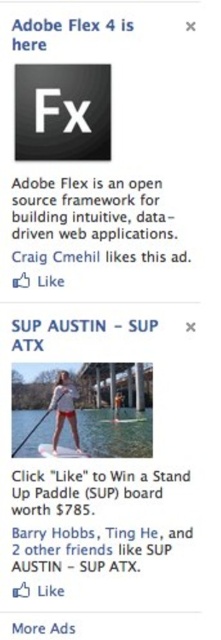
Does white fabric shorts at center have a lesser width compared to white fabric paddle at center?

No, white fabric shorts at center is not thinner than white fabric paddle at center.

You are a GUI agent. You are given a task and a screenshot of the screen. Output one action in this format:
    pyautogui.click(x=<x>, y=<y>)
    Task: Click on the white fabric shorts at center
    This screenshot has width=221, height=640.
    Given the screenshot: What is the action you would take?
    tap(64, 406)

The image size is (221, 640). Find the location of `white fabric shorts at center`. white fabric shorts at center is located at coordinates (64, 406).

Between white glossy water ski at lower center and white fabric paddle at center, which one appears on the right side from the viewer's perspective?

white fabric paddle at center is more to the right.

Does white glossy water ski at lower center have a lesser height compared to white fabric paddle at center?

Correct, white glossy water ski at lower center is not as tall as white fabric paddle at center.

Locate an element on the screen. The image size is (221, 640). white glossy water ski at lower center is located at coordinates (59, 451).

Is point (59, 406) positioned before point (133, 420)?

Yes, it is.

From the picture: Between white fabric shorts at center and white plastic water ski at center, which one has less height?

Standing shorter between the two is white plastic water ski at center.

Between point (70, 380) and point (123, 420), which one is positioned behind?

Point (123, 420)

Locate an element on the screen. The width and height of the screenshot is (221, 640). white fabric shorts at center is located at coordinates (64, 406).